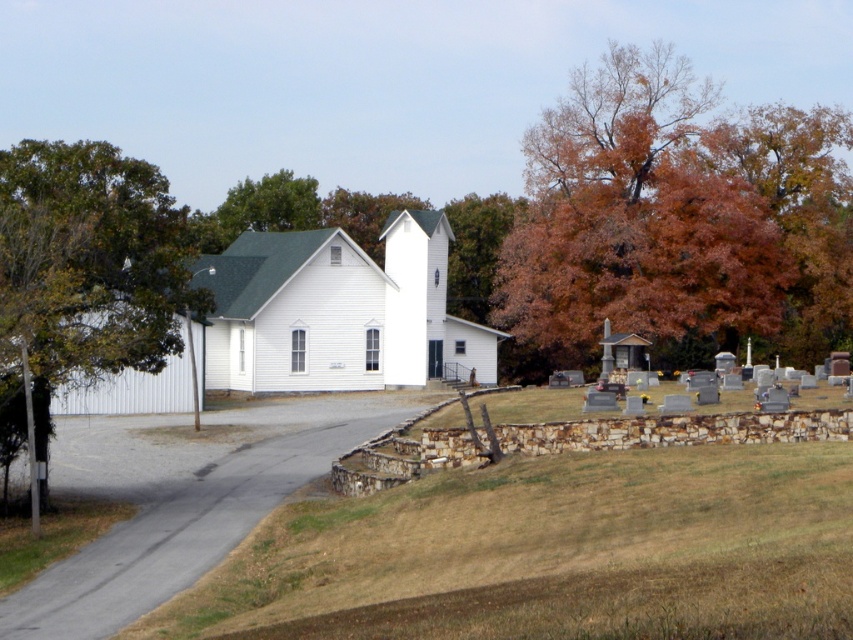
You are standing at the entrance of the white church with a green roof. You see autumn leaves at right and a green leafy tree at upper left. Which object is positioned more to the east?

The autumn leaves at right are positioned more to the east because they are located to the right of the green leafy tree at upper left, which would be to the east if the tree is at the upper left.